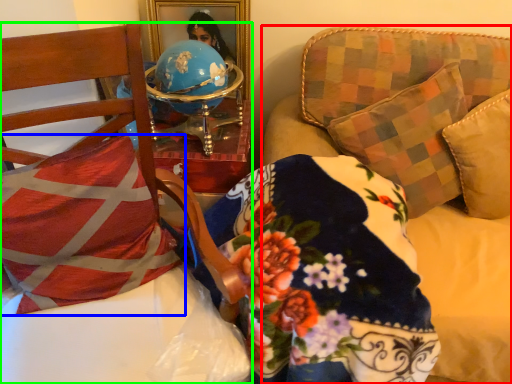
Question: Which object is positioned farthest from studio couch (highlighted by a red box)? Select from pillow (highlighted by a blue box) and furniture (highlighted by a green box).

Choices:
 (A) pillow
 (B) furniture

Answer: (A)